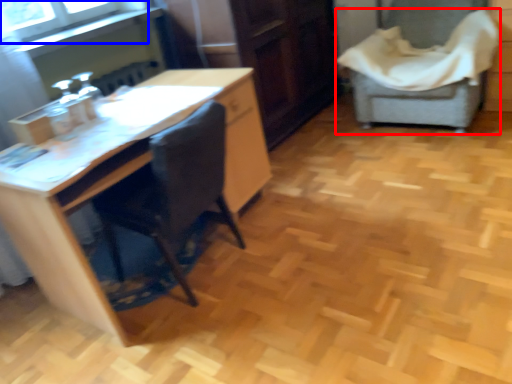
Question: Which of the following is the closest to the observer, chair (highlighted by a red box) or window screen (highlighted by a blue box)?

Choices:
 (A) chair
 (B) window screen

Answer: (B)